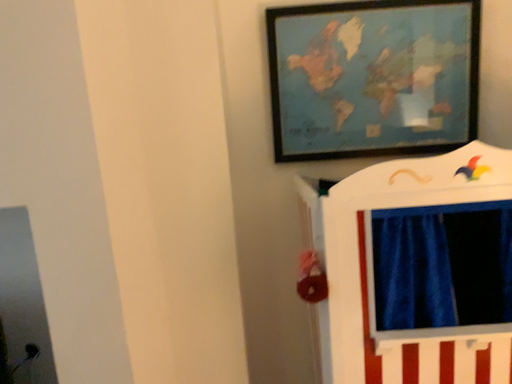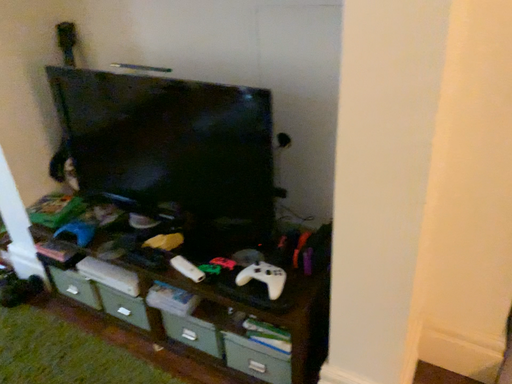
Question: Which way did the camera rotate in the video?

Choices:
 (A) rotated upward
 (B) rotated downward

Answer: (B)